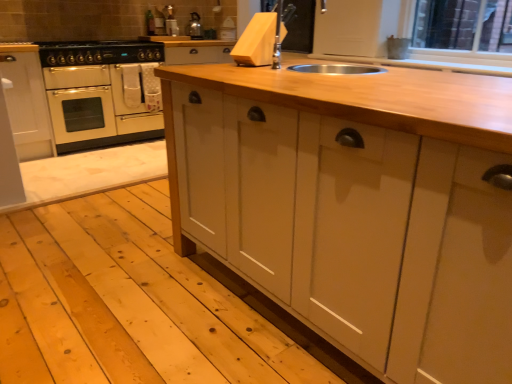
Question: Is white matte cabinet at left inside or outside of black matte gas stove at upper left?

Choices:
 (A) inside
 (B) outside

Answer: (B)

Question: Relative to black matte gas stove at upper left, is white matte cabinet at left in front or behind?

Choices:
 (A) front
 (B) behind

Answer: (A)

Question: Estimate the real-world distances between objects in this image. Which object is closer to the white matte cabinet at left?

Choices:
 (A) black matte gas stove at upper left
 (B) natural wood countertop at center
 (C) metallic silver kettle at upper center
 (D) cream matte oven at left

Answer: (D)

Question: Considering the real-world distances, which object is farthest from the cream matte oven at left?

Choices:
 (A) black matte gas stove at upper left
 (B) white matte cabinet at left
 (C) metallic silver kettle at upper center
 (D) natural wood countertop at center

Answer: (D)